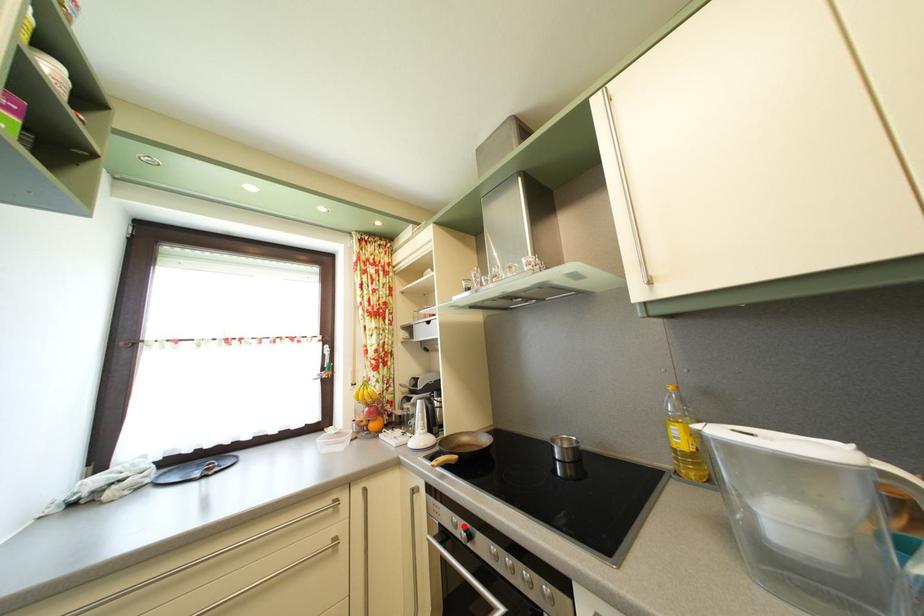
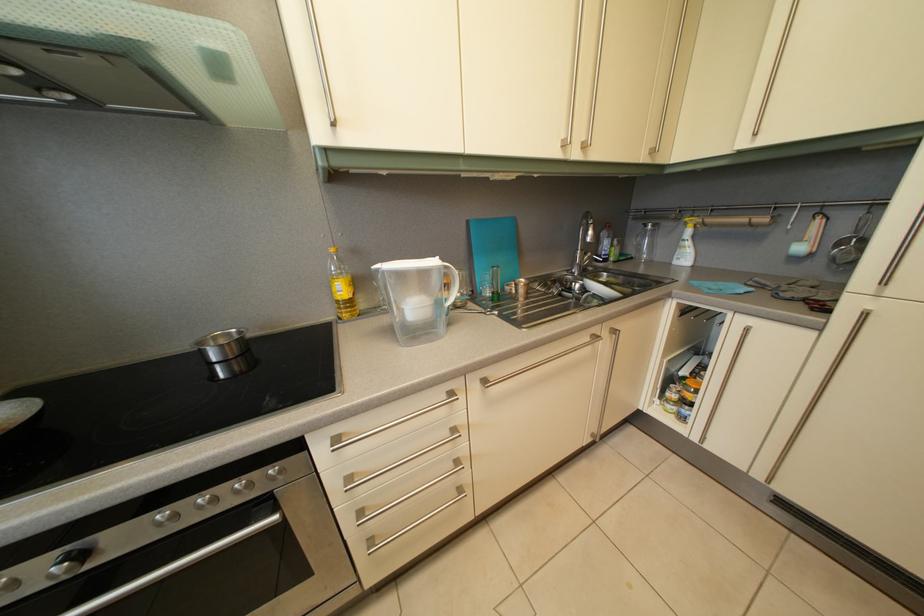
Question: I am providing you with two images of the same scene from different viewpoints. A red point is marked on the first image. At the location where the point appears in image 1, is it still visible in image 2?

Choices:
 (A) Yes
 (B) No

Answer: (A)